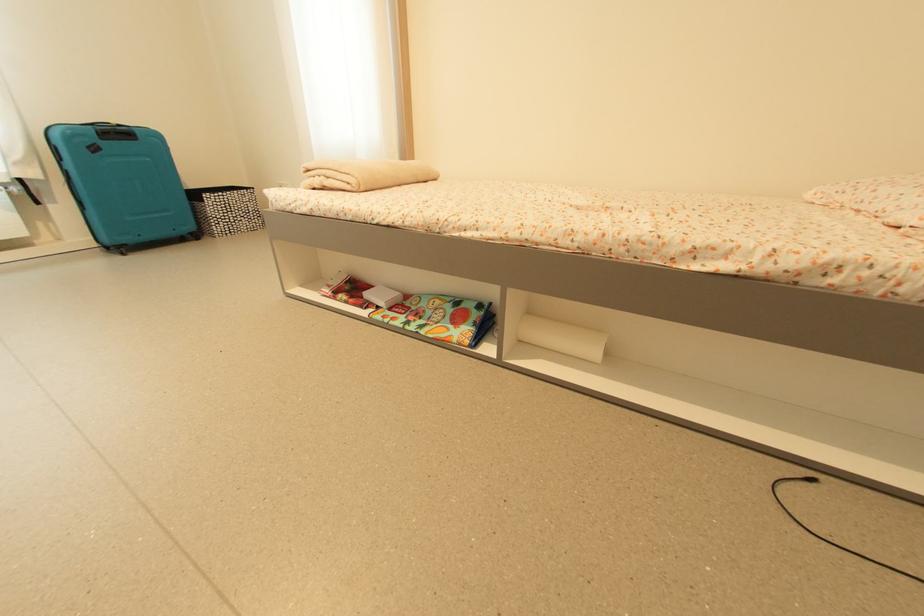
Which object does [225,209] point to?

It refers to a patterned storage basket.